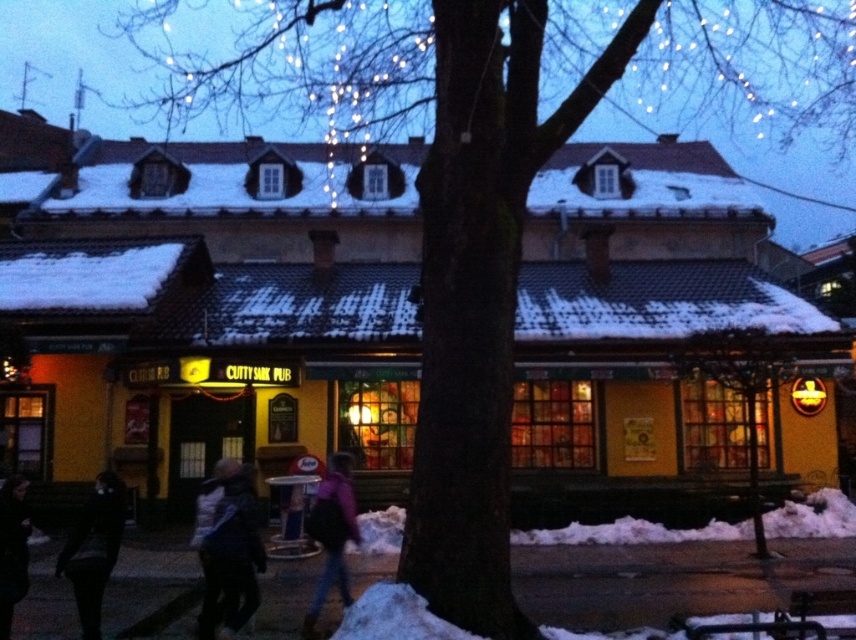
You are standing at the center of the snow scene. A white fuzzy coat is at point (230,554). Is the white fuzzy coat at lower left closer to the large tree trunk on the right or the yellow building on the left?

The white fuzzy coat at lower left is located at point (230,554), which is closer to the large tree trunk on the right than the yellow building on the left.

Looking at this image, you are standing at the center of the snow covered street and see two points marked in the image. Which point is closer to you, point (93,589) or point (342,540)?

Point (93,589) is in front of point (342,540), so it is closer to you.